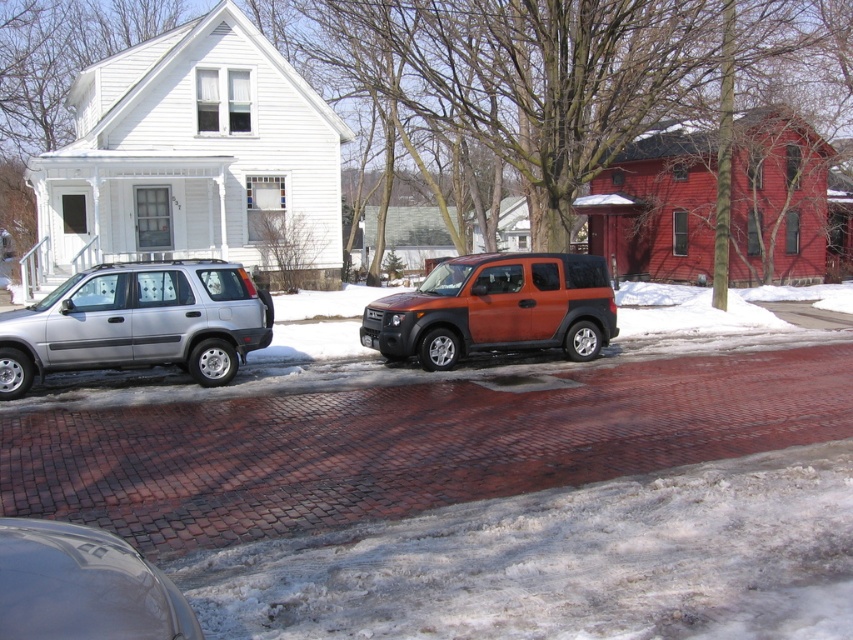
You are a delivery person trying to park your 6.5 feet tall delivery van between the orange matte suv at center and the shiny black car at lower left. Based on the scene, can your van fit vertically between them?

The orange matte suv at center is taller than the shiny black car at lower left. The total vertical space between them would depend on their combined height. However, since the van is 6.5 feet tall, and the SUV is taller than the car, there might be enough clearance if the sum of their heights allows. But without exact measurements, it is uncertain. However, according to the description, the SUV is taller, so the space between them may be sufficient for the van to fit vertically.

You are standing on the residential street and want to walk from point A to point B. Point A is located at coordinate point (172, 362) and point B is at coordinate point (119, 605). Which direction should you walk to move from point A to point B?

Since point A is further to the viewer than point B, you should walk towards the direction away from you to reach point B from point A.